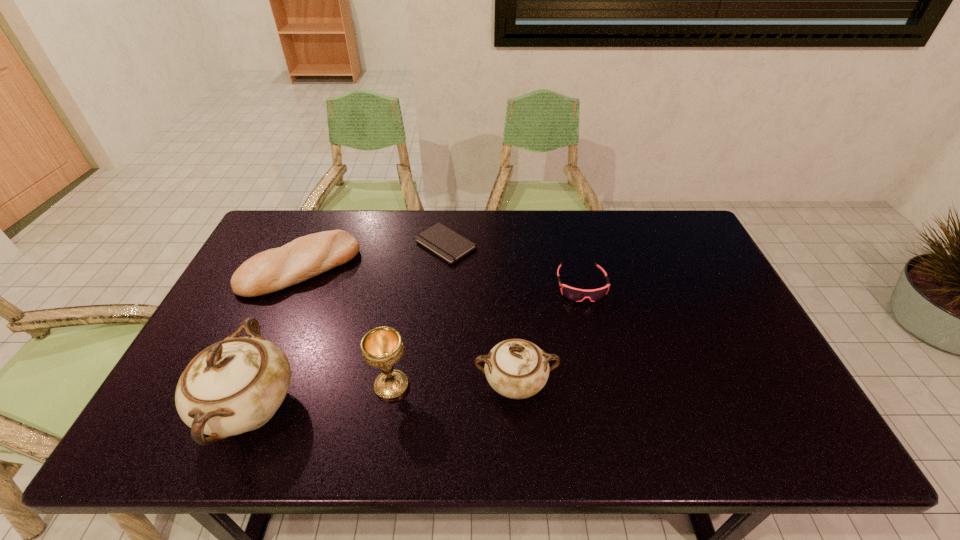
The image size is (960, 540). I want to click on object that is at the near left corner, so click(236, 385).

Image resolution: width=960 pixels, height=540 pixels. In the image, there is a desktop. What are the coordinates of `vacant space at the far edge` in the screenshot? It's located at (495, 233).

In the image, there is a desktop. At what (x,y) coordinates should I click in order to perform the action: click on vacant space at the near edge. Please return your answer as a coordinate pair (x, y). Looking at the image, I should click on (542, 400).

The height and width of the screenshot is (540, 960). I want to click on free spot at the left edge of the desktop, so pos(271,318).

You are a GUI agent. You are given a task and a screenshot of the screen. Output one action in this format:
    pyautogui.click(x=<x>, y=<y>)
    Task: Click on the vacant space at the right edge of the desktop
    
    Given the screenshot: What is the action you would take?
    pyautogui.click(x=689, y=322)

Where is `free location at the far left corner of the desktop`? This screenshot has width=960, height=540. free location at the far left corner of the desktop is located at coordinates (303, 226).

Identify the location of blank region between the shortest object and the left chinaware. Image resolution: width=960 pixels, height=540 pixels. (348, 326).

You are a GUI agent. You are given a task and a screenshot of the screen. Output one action in this format:
    pyautogui.click(x=<x>, y=<y>)
    Task: Click on the free spot between the shortest object and the third shortest object
    
    Given the screenshot: What is the action you would take?
    pyautogui.click(x=373, y=255)

At what (x,y) coordinates should I click in order to perform the action: click on vacant area between the chalice and the tallest object. Please return your answer as a coordinate pair (x, y). Image resolution: width=960 pixels, height=540 pixels. Looking at the image, I should click on (321, 397).

At what (x,y) coordinates should I click in order to perform the action: click on unoccupied area between the fifth tallest object and the right chinaware. Please return your answer as a coordinate pair (x, y). Looking at the image, I should click on (548, 335).